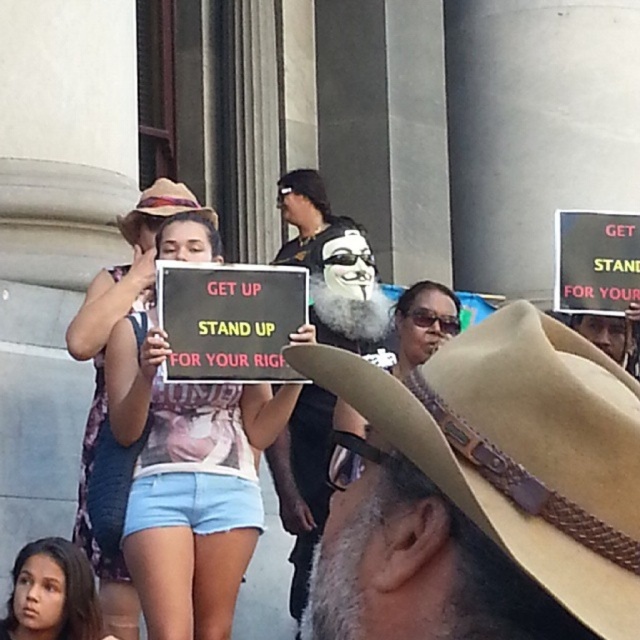
Question: Which object is farther from the camera taking this photo?

Choices:
 (A) brown straw cowboy hat at center
 (B) matte black mask at center
 (C) light blue denim shorts at lower left

Answer: (B)

Question: Does matte white tank top at center have a greater width compared to light blue denim shorts at lower left?

Choices:
 (A) no
 (B) yes

Answer: (B)

Question: Does brown leather cowboy hat at lower right appear over light blue denim shorts at lower left?

Choices:
 (A) yes
 (B) no

Answer: (A)

Question: Which object is farther from the camera taking this photo?

Choices:
 (A) light blue denim shorts at lower left
 (B) brown leather cowboy hat at lower right
 (C) brown straw cowboy hat at center
 (D) matte pink tank top at center

Answer: (C)

Question: Can you confirm if brown leather cowboy hat at lower right is positioned above brown straw cowboy hat at center?

Choices:
 (A) yes
 (B) no

Answer: (B)

Question: Which object appears farthest from the camera in this image?

Choices:
 (A) matte white tank top at center
 (B) light blue denim shorts at lower left
 (C) brown straw cowboy hat at center
 (D) matte black mask at center

Answer: (D)